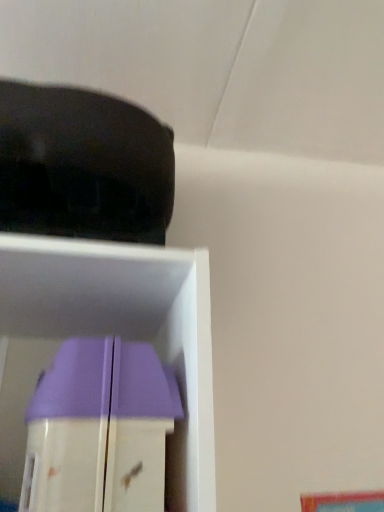
Describe the element at coordinates (99, 429) in the screenshot. I see `purple plastic toy at lower left` at that location.

Locate an element on the screen. purple plastic toy at lower left is located at coordinates point(99,429).

Find the location of `purple plastic toy at lower left`. purple plastic toy at lower left is located at coordinates (99, 429).